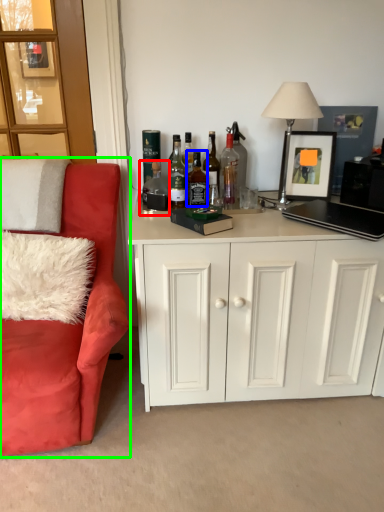
Question: Which object is positioned farthest from bottle (highlighted by a red box)? Select from bottle (highlighted by a blue box) and chair (highlighted by a green box).

Choices:
 (A) bottle
 (B) chair

Answer: (B)